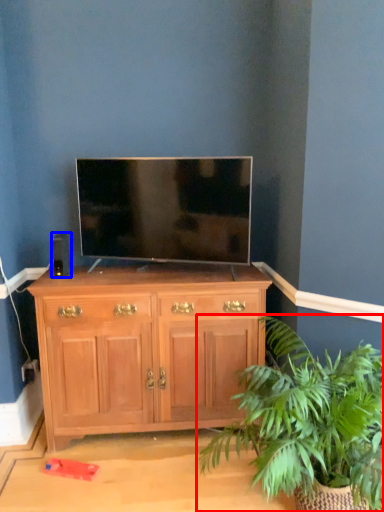
Question: Which point is further to the camera, houseplant (highlighted by a red box) or speaker (highlighted by a blue box)?

Choices:
 (A) houseplant
 (B) speaker

Answer: (B)